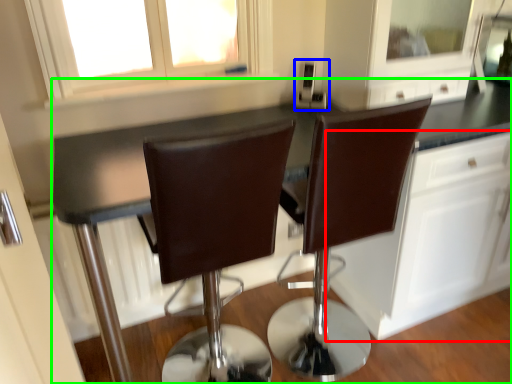
Question: Which object is positioned closest to cabinetry (highlighted by a red box)? Select from appliance (highlighted by a blue box) and countertop (highlighted by a green box).

Choices:
 (A) appliance
 (B) countertop

Answer: (B)